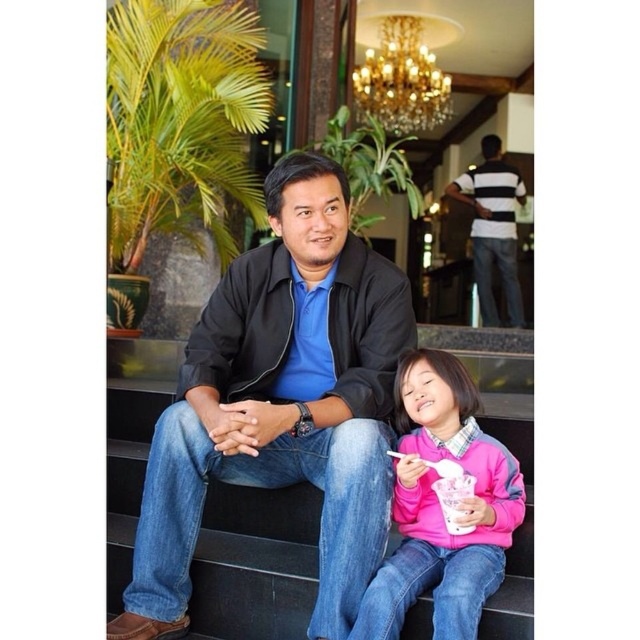
Who is taller, smooth black stairs at center or gold metallic chandelier at upper center?

gold metallic chandelier at upper center is taller.

Who is more distant from viewer, (513, 625) or (408, 113)?

Point (408, 113)

This screenshot has height=640, width=640. In order to click on smooth black stairs at center in this screenshot , I will do `click(253, 563)`.

In the scene shown: Which is above, pink fleece sweater at lower right or gold metallic chandelier at upper center?

gold metallic chandelier at upper center is above.

Can you confirm if pink fleece sweater at lower right is bigger than gold metallic chandelier at upper center?

No.

The image size is (640, 640). In order to click on pink fleece sweater at lower right in this screenshot , I will do `click(444, 506)`.

Can you confirm if black leather jacket at center is taller than gold metallic chandelier at upper center?

Answer: Yes.

Who is positioned more to the left, black leather jacket at center or gold metallic chandelier at upper center?

black leather jacket at center is more to the left.

Find the location of a particular element. black leather jacket at center is located at coordinates (282, 403).